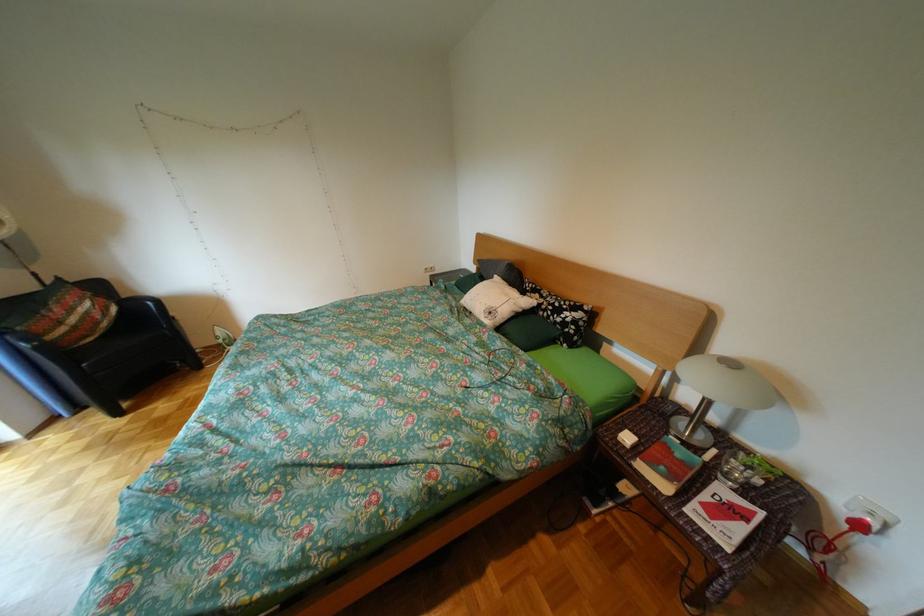
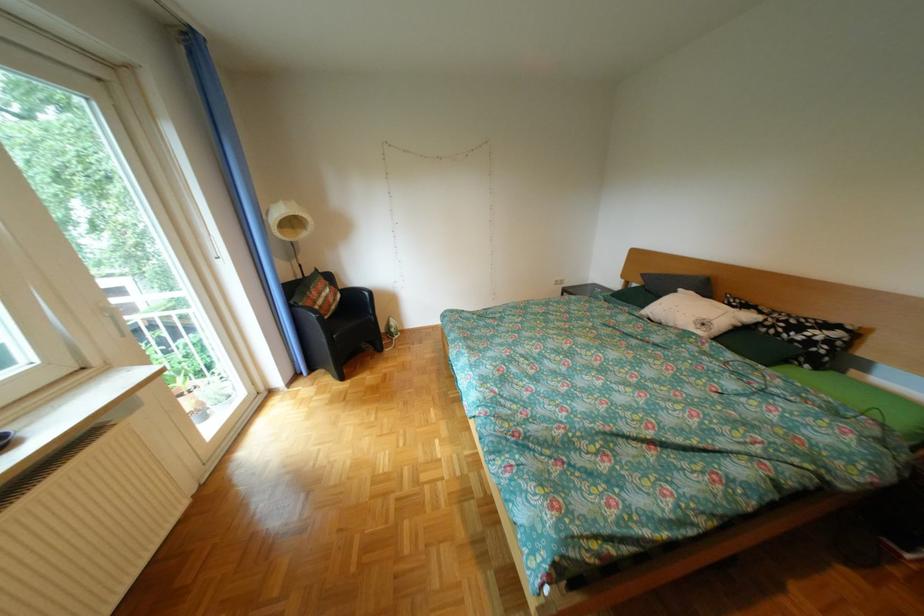
Question: Which direction would the cameraman need to move to produce the second image? Reply with the corresponding letter.

Choices:
 (A) Left
 (B) Right
 (C) Forward
 (D) Backward

Answer: (A)